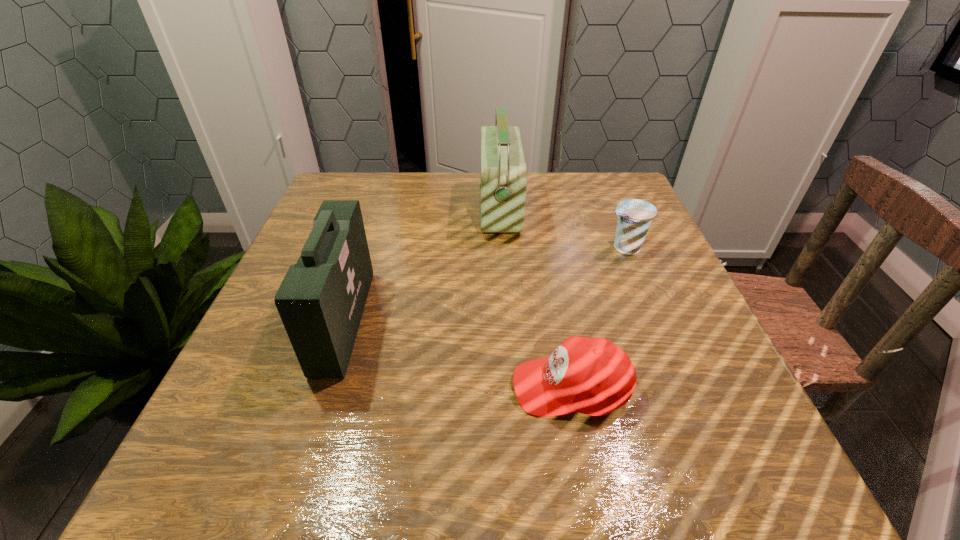
Where is `vacant area situated 0.120m on the front panel of the baseball cap`? Image resolution: width=960 pixels, height=540 pixels. vacant area situated 0.120m on the front panel of the baseball cap is located at coordinates (438, 387).

I want to click on free space located on the front panel of the baseball cap, so click(301, 387).

Where is `object that is at the far edge`? This screenshot has width=960, height=540. object that is at the far edge is located at coordinates (503, 183).

Where is `object located at the left edge`? The height and width of the screenshot is (540, 960). object located at the left edge is located at coordinates (321, 300).

At what (x,y) coordinates should I click in order to perform the action: click on object located at the right edge. Please return your answer as a coordinate pair (x, y). This screenshot has height=540, width=960. Looking at the image, I should click on (634, 215).

Find the location of a particular element. The image size is (960, 540). vacant point at the far edge is located at coordinates click(430, 204).

This screenshot has width=960, height=540. What are the coordinates of `free region at the near edge of the desktop` in the screenshot? It's located at click(334, 487).

In the image, there is a desktop. At what (x,y) coordinates should I click in order to perform the action: click on vacant space at the left edge. Please return your answer as a coordinate pair (x, y). Looking at the image, I should click on (286, 368).

In order to click on vacant point at the right edge in this screenshot , I will do coord(691,364).

The image size is (960, 540). Find the location of `free space at the near left corner of the desktop`. free space at the near left corner of the desktop is located at coordinates (205, 476).